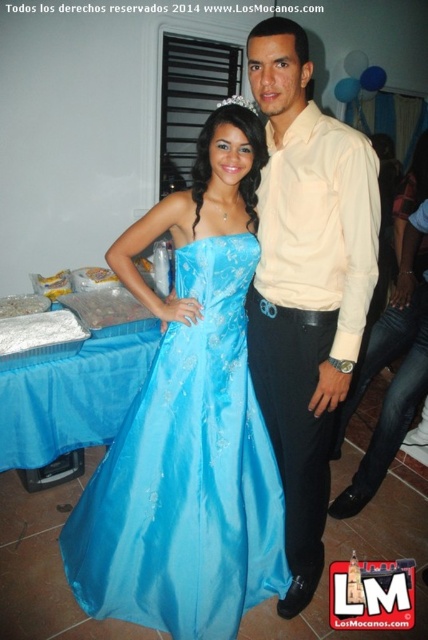
Is point (181, 336) closer to viewer compared to point (305, 387)?

No, (181, 336) is behind (305, 387).

Does shiny blue gown at center have a lesser width compared to matte beige shirt at center?

No.

Who is more distant from viewer, (216, 474) or (297, 232)?

Positioned behind is point (216, 474).

This screenshot has width=428, height=640. Find the location of `shiny blue gown at center`. shiny blue gown at center is located at coordinates coord(187,474).